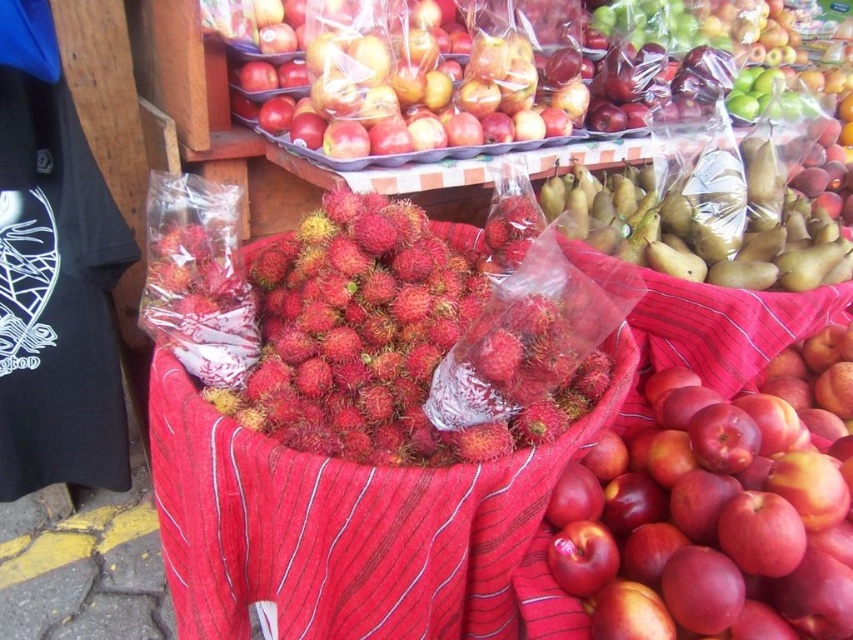
You are a customer at the fruit stall and want to buy both the glossy red apple at center and the ruddy hairy rambutan at center. If you have a small bag that can only hold one of them, which fruit should you choose based on their size?

The glossy red apple at center is wider than the ruddy hairy rambutan at center, so you should choose the ruddy hairy rambutan at center to fit in the small bag.

You are a customer at the fruit stall and want to pick up both the glossy red apple at center and the ruddy hairy rambutan at center. Which fruit should you reach for first if you want to grab the one that is lower?

The glossy red apple at center is located below the ruddy hairy rambutan at center, so you should reach for the glossy red apple at center first.

You are a customer at the fruit stall and want to buy a fruit that is wider. Which one should you choose between the glossy red apple at center and the green matte pears at center?

The green matte pears at center have a greater width compared to the glossy red apple at center, so you should choose the green matte pears at center.